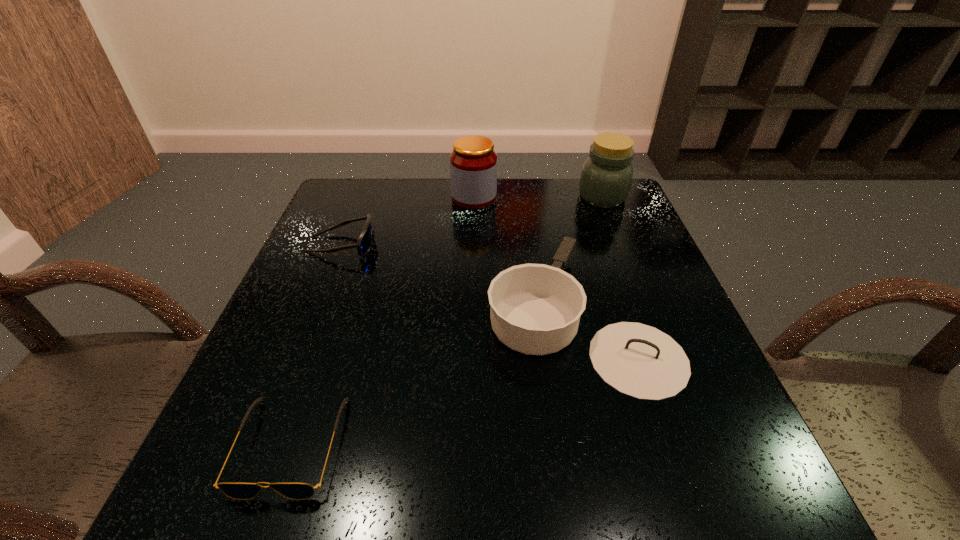
This screenshot has height=540, width=960. In order to click on free location located 0.290m on the front-facing side of the second shortest object in this screenshot , I will do click(x=493, y=245).

Image resolution: width=960 pixels, height=540 pixels. In order to click on object that is at the near edge in this screenshot , I will do `click(293, 490)`.

Image resolution: width=960 pixels, height=540 pixels. I want to click on jar situated at the right edge, so click(x=606, y=176).

I want to click on saucepan situated at the right edge, so click(x=535, y=309).

At what (x,y) coordinates should I click in order to perform the action: click on object located at the near left corner. Please return your answer as a coordinate pair (x, y). The width and height of the screenshot is (960, 540). Looking at the image, I should click on (293, 490).

The height and width of the screenshot is (540, 960). I want to click on object at the far right corner, so click(x=606, y=176).

Find the location of `vacant area at the far edge of the desktop`. vacant area at the far edge of the desktop is located at coordinates (507, 217).

You are a GUI agent. You are given a task and a screenshot of the screen. Output one action in this format:
    pyautogui.click(x=<x>, y=<y>)
    Task: Click on the free space at the near edge of the desktop
    This screenshot has height=540, width=960.
    Given the screenshot: What is the action you would take?
    pyautogui.click(x=528, y=496)

The height and width of the screenshot is (540, 960). I want to click on blank space at the left edge of the desktop, so click(x=262, y=339).

This screenshot has width=960, height=540. What are the coordinates of `vacant space at the right edge` in the screenshot? It's located at (649, 247).